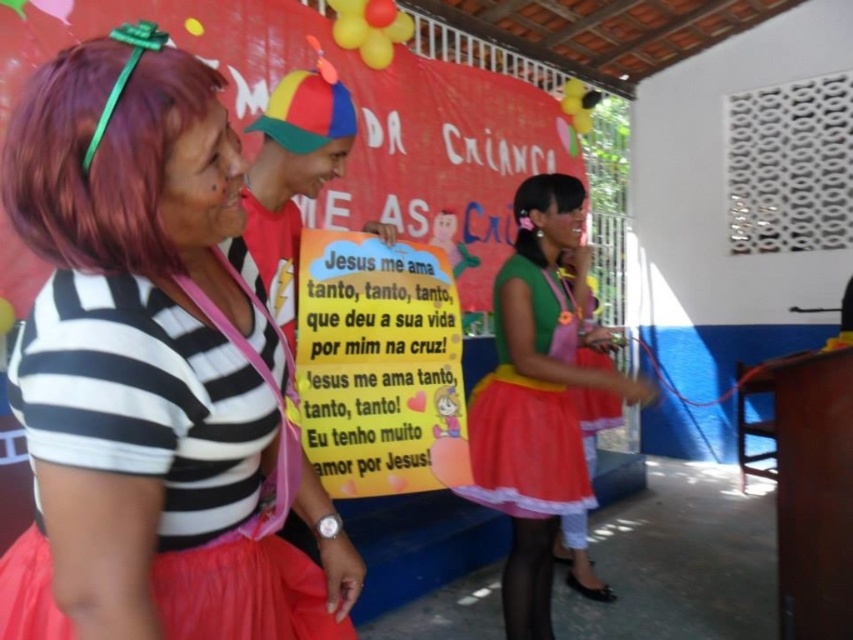
Question: Which point is closer to the camera taking this photo?

Choices:
 (A) (86, 243)
 (B) (534, 307)

Answer: (A)

Question: Estimate the real-world distances between objects in this image. Which object is closer to the purple silky hair at left?

Choices:
 (A) matte green dress at center
 (B) matte black shirt at center
 (C) black silky hair at upper center
 (D) matte green fabric dress at center

Answer: (B)

Question: Does matte black shirt at center have a lesser width compared to black silky hair at upper center?

Choices:
 (A) yes
 (B) no

Answer: (B)

Question: Based on their relative distances, which object is farther from the matte black shirt at center?

Choices:
 (A) black silky hair at upper center
 (B) yellow paper poster at center
 (C) matte green dress at center
 (D) matte green fabric dress at center

Answer: (A)

Question: Is matte black shirt at center bigger than purple silky hair at left?

Choices:
 (A) no
 (B) yes

Answer: (B)

Question: Is yellow paper poster at center to the right of purple silky hair at left from the viewer's perspective?

Choices:
 (A) no
 (B) yes

Answer: (B)